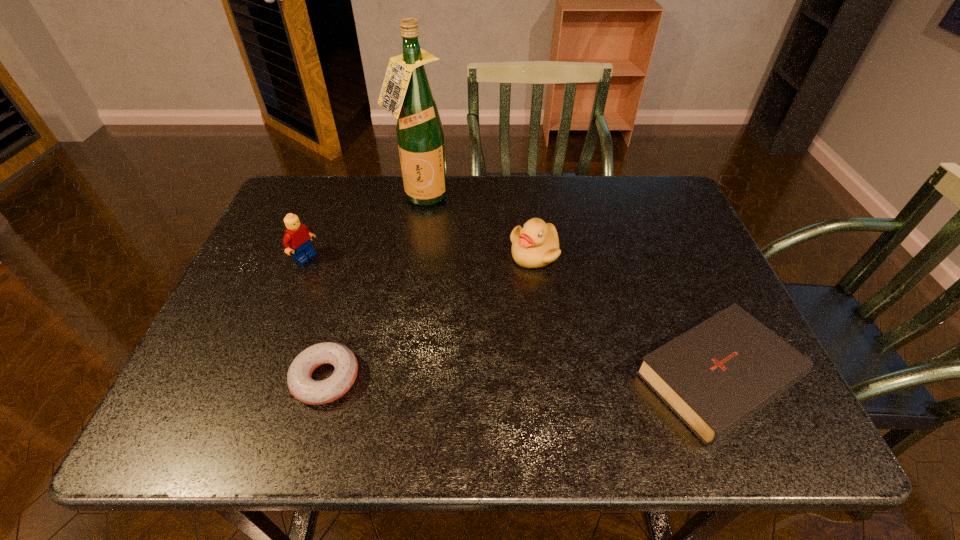
Locate an element on the screen. The height and width of the screenshot is (540, 960). free space on the desktop that is between the shortest object and the rightmost object and is positioned on the front-facing side of the third tallest object is located at coordinates (500, 377).

I want to click on vacant space on the desktop that is between the doughnut and the second shortest object and is positioned on the front-facing side of the Lego, so click(522, 377).

Locate an element on the screen. vacant space on the desktop that is between the doughnut and the second shortest object and is positioned on the front-facing side of the liquor is located at coordinates (496, 377).